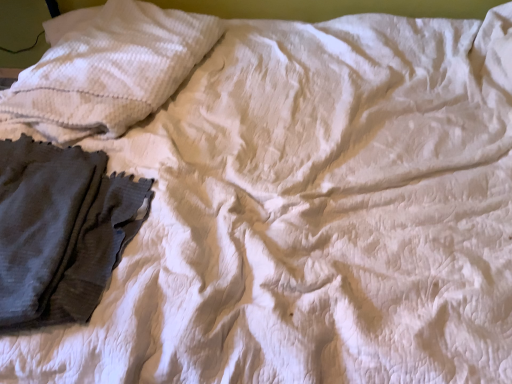
In order to face white textured pillow at upper left, should I rotate leftwards or rightwards?

It's best to rotate left around 17.149 degrees.

Describe the element at coordinates (108, 68) in the screenshot. I see `white textured pillow at upper left` at that location.

Find the location of a particular element. The width and height of the screenshot is (512, 384). white textured pillow at upper left is located at coordinates (108, 68).

Describe the element at coordinates (61, 231) in the screenshot. I see `dark gray textured fabric at left` at that location.

Locate an element on the screen. dark gray textured fabric at left is located at coordinates (61, 231).

Find the location of a particular element. Image resolution: width=512 pixels, height=384 pixels. white textured pillow at upper left is located at coordinates (108, 68).

Which object is positioned more to the right, dark gray textured fabric at left or white textured pillow at upper left?

Positioned to the right is white textured pillow at upper left.

Is dark gray textured fabric at left behind white textured pillow at upper left?

No, the depth of dark gray textured fabric at left is less than that of white textured pillow at upper left.

Considering the points (67, 276) and (204, 43), which point is in front, point (67, 276) or point (204, 43)?

The point (67, 276) is closer to the camera.

From the image's perspective, which one is positioned lower, dark gray textured fabric at left or white textured pillow at upper left?

dark gray textured fabric at left appears lower in the image.

From a real-world perspective, is dark gray textured fabric at left above or below white textured pillow at upper left?

Clearly, from a real-world perspective, dark gray textured fabric at left is below white textured pillow at upper left.

Considering the sizes of objects dark gray textured fabric at left and white textured pillow at upper left in the image provided, who is thinner, dark gray textured fabric at left or white textured pillow at upper left?

With smaller width is dark gray textured fabric at left.

Which of these two, dark gray textured fabric at left or white textured pillow at upper left, stands shorter?

Standing shorter between the two is dark gray textured fabric at left.

Does dark gray textured fabric at left have a smaller size compared to white textured pillow at upper left?

Yes.

Would you say white textured pillow at upper left is part of dark gray textured fabric at left's contents?

No, dark gray textured fabric at left does not contain white textured pillow at upper left.

Would you say dark gray textured fabric at left is a long distance from white textured pillow at upper left?

dark gray textured fabric at left is actually quite close to white textured pillow at upper left.

Is dark gray textured fabric at left oriented towards white textured pillow at upper left?

No, dark gray textured fabric at left is not turned towards white textured pillow at upper left.

Find the location of a particular element. pillow behind the dark gray textured fabric at left is located at coordinates tap(108, 68).

Does white textured pillow at upper left appear on the right side of dark gray textured fabric at left?

Indeed, white textured pillow at upper left is positioned on the right side of dark gray textured fabric at left.

Considering the positions of objects white textured pillow at upper left and dark gray textured fabric at left in the image provided, who is in front, white textured pillow at upper left or dark gray textured fabric at left?

Positioned in front is dark gray textured fabric at left.

Which is closer, [51,115] or [20,160]?

Point [51,115] appears to be farther away from the viewer than point [20,160].

From the image's perspective, is white textured pillow at upper left over dark gray textured fabric at left?

Correct, white textured pillow at upper left appears higher than dark gray textured fabric at left in the image.

From a real-world perspective, which is physically below, white textured pillow at upper left or dark gray textured fabric at left?

From a 3D spatial view, dark gray textured fabric at left is below.

Which object is wider, white textured pillow at upper left or dark gray textured fabric at left?

white textured pillow at upper left is wider.

In terms of height, does white textured pillow at upper left look taller or shorter compared to dark gray textured fabric at left?

In the image, white textured pillow at upper left appears to be taller than dark gray textured fabric at left.

Between white textured pillow at upper left and dark gray textured fabric at left, which one has larger size?

With larger size is white textured pillow at upper left.

Would you say dark gray textured fabric at left is part of white textured pillow at upper left's contents?

That's incorrect, dark gray textured fabric at left is not inside white textured pillow at upper left.

Is white textured pillow at upper left next to dark gray textured fabric at left and touching it?

No, white textured pillow at upper left is not beside dark gray textured fabric at left.

Is dark gray textured fabric at left at the back of white textured pillow at upper left?

No, dark gray textured fabric at left is not at the back of white textured pillow at upper left.

Where is `garment below the white textured pillow at upper left (from the image's perspective)`? garment below the white textured pillow at upper left (from the image's perspective) is located at coordinates (61, 231).

Identify the location of garment on the left side of white textured pillow at upper left. This screenshot has width=512, height=384. (61, 231).

You are a GUI agent. You are given a task and a screenshot of the screen. Output one action in this format:
    pyautogui.click(x=<x>, y=<y>)
    Task: Click on the pillow behind the dark gray textured fabric at left
    
    Given the screenshot: What is the action you would take?
    pyautogui.click(x=108, y=68)